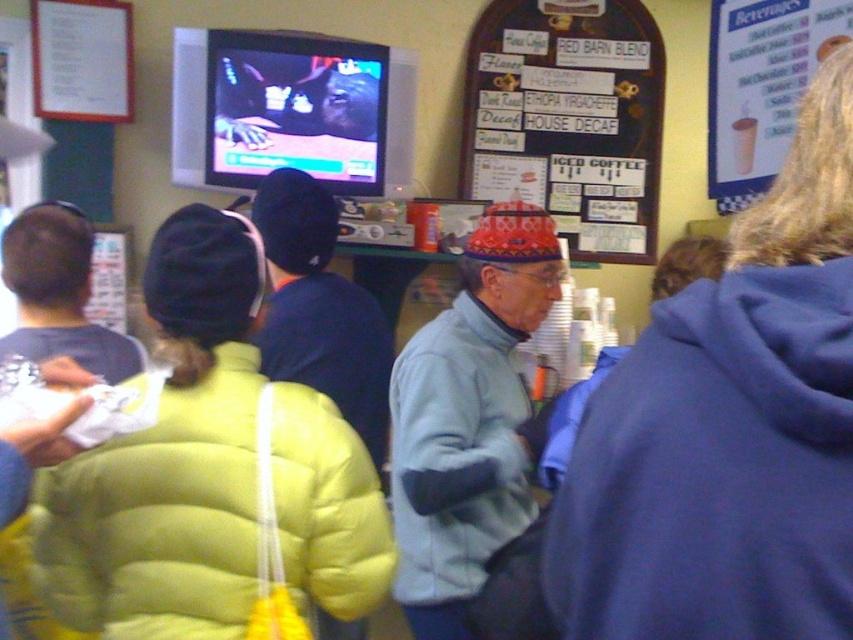
Is wooden signboard at upper center positioned at the back of matte blue shirt at left?

Yes, wooden signboard at upper center is behind matte blue shirt at left.

Who is more forward, (654, 177) or (1, 248)?

Positioned in front is point (1, 248).

You are a GUI agent. You are given a task and a screenshot of the screen. Output one action in this format:
    pyautogui.click(x=<x>, y=<y>)
    Task: Click on the wooden signboard at upper center
    The width and height of the screenshot is (853, 640).
    Given the screenshot: What is the action you would take?
    pyautogui.click(x=569, y=118)

Which is more to the right, yellow puffer jacket at center or light blue jacket at center?

From the viewer's perspective, light blue jacket at center appears more on the right side.

Locate an element on the screen. yellow puffer jacket at center is located at coordinates (170, 460).

Is yellow puffer jacket at center wider than wooden signboard at upper center?

No.

Is point (383, 540) less distant than point (602, 113)?

Yes, it is in front of point (602, 113).

Where is `yellow puffer jacket at center`? yellow puffer jacket at center is located at coordinates (170, 460).